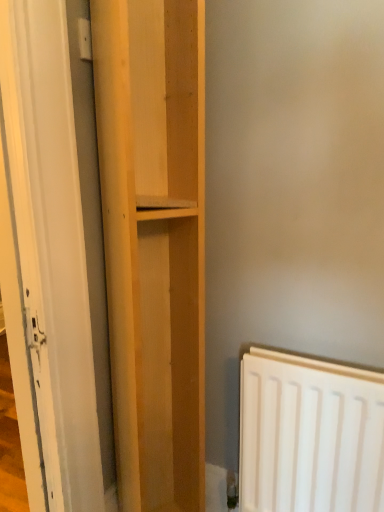
Question: From the image's perspective, is white glossy door at left above or below light wood shelf at center?

Choices:
 (A) below
 (B) above

Answer: (B)

Question: From a real-world perspective, is white glossy door at left positioned above or below light wood shelf at center?

Choices:
 (A) above
 (B) below

Answer: (A)

Question: Considering the positions of point (26, 228) and point (158, 84), is point (26, 228) closer or farther from the camera than point (158, 84)?

Choices:
 (A) farther
 (B) closer

Answer: (B)

Question: Would you say light wood shelf at center is to the left or to the right of white glossy door at left in the picture?

Choices:
 (A) left
 (B) right

Answer: (B)

Question: Is point (122, 269) closer or farther from the camera than point (71, 26)?

Choices:
 (A) closer
 (B) farther

Answer: (B)

Question: From the image's perspective, relative to white glossy door at left, is light wood shelf at center above or below?

Choices:
 (A) below
 (B) above

Answer: (A)

Question: From a real-world perspective, is light wood shelf at center positioned above or below white glossy door at left?

Choices:
 (A) above
 (B) below

Answer: (B)